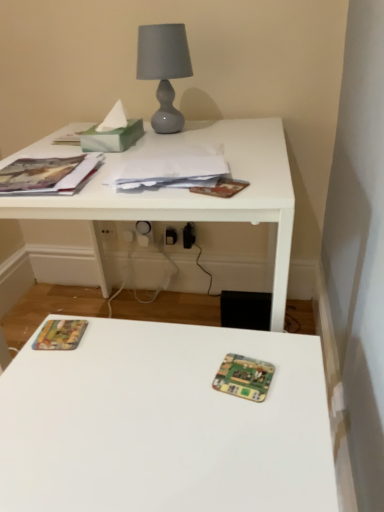
This screenshot has height=512, width=384. What are the coordinates of `vacant point to the right of white paper at center` in the screenshot? It's located at (260, 167).